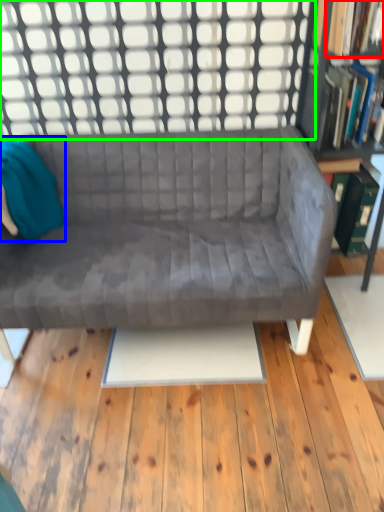
Question: Estimate the real-world distances between objects in this image. Which object is farther from book (highlighted by a red box), bean bag chair (highlighted by a blue box) or window (highlighted by a green box)?

Choices:
 (A) bean bag chair
 (B) window

Answer: (A)